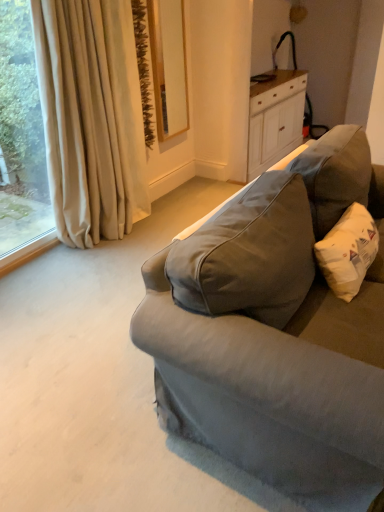
Question: Is beige curtain at left taller or shorter than white cotton pillow at right?

Choices:
 (A) tall
 (B) short

Answer: (A)

Question: From a real-world perspective, is beige curtain at left positioned above or below white cotton pillow at right?

Choices:
 (A) above
 (B) below

Answer: (A)

Question: Which is nearer to the white cotton pillow at right?

Choices:
 (A) matte gray fabric couch at right
 (B) beige curtain at left
 (C) beige fabric curtain at left
 (D) white wood cabinet at upper right

Answer: (A)

Question: Which of these objects is positioned closest to the matte gray fabric couch at right?

Choices:
 (A) beige curtain at left
 (B) white cotton pillow at right
 (C) beige fabric curtain at left
 (D) white wood cabinet at upper right

Answer: (B)